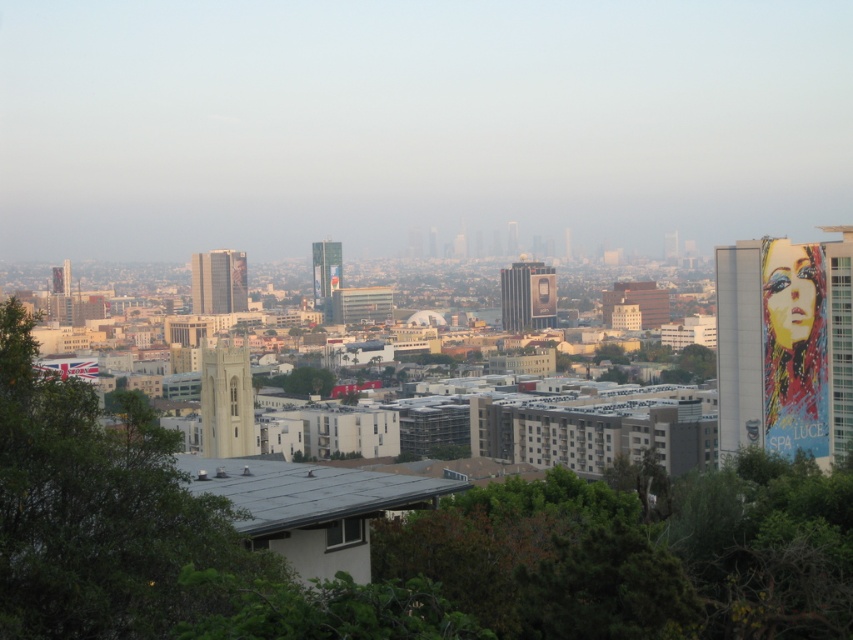
Question: Does green leafy tree at left have a lesser width compared to matte glass skyscraper at center?

Choices:
 (A) no
 (B) yes

Answer: (A)

Question: Does green leafy tree at left appear on the right side of metallic glass billboard at center?

Choices:
 (A) no
 (B) yes

Answer: (A)

Question: Which object is the closest to the painted mural at right?

Choices:
 (A) green leafy tree at left
 (B) metallic glass billboard at center
 (C) matte glass skyscraper at center

Answer: (B)

Question: Which of the following is the closest to the observer?

Choices:
 (A) (218, 292)
 (B) (619, 364)
 (C) (531, 285)

Answer: (C)

Question: Estimate the real-world distances between objects in this image. Which object is farther from the matte glass skyscraper at center?

Choices:
 (A) metallic glass billboard at center
 (B) green leafy tree at center
 (C) light beige stone tower at center

Answer: (B)

Question: Is the position of green leafy tree at left more distant than that of metallic glass billboard at center?

Choices:
 (A) no
 (B) yes

Answer: (A)